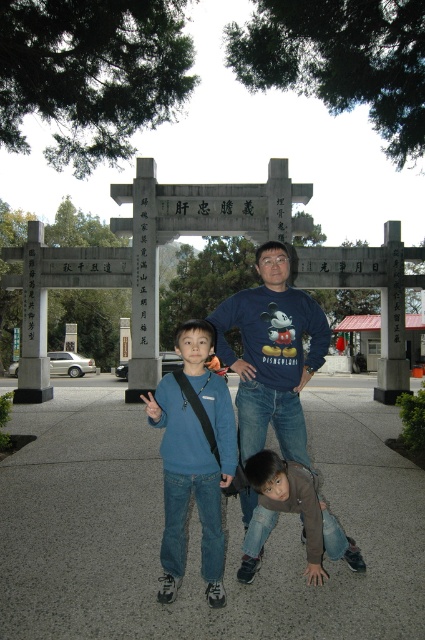
Question: Estimate the real-world distances between objects in this image. Which object is closer to the blue cotton shirt at center?

Choices:
 (A) matte blue sweater at center
 (B) brown denim jeans at lower center

Answer: (B)

Question: Which object appears farthest from the camera in this image?

Choices:
 (A) brown denim jeans at lower center
 (B) blue cotton shirt at center

Answer: (B)

Question: Which of these objects is positioned farthest from the matte blue sweater at center?

Choices:
 (A) brown denim jeans at lower center
 (B) blue cotton shirt at center

Answer: (B)

Question: Does matte blue sweater at center have a larger size compared to brown denim jeans at lower center?

Choices:
 (A) no
 (B) yes

Answer: (B)

Question: Can you confirm if matte blue sweater at center is bigger than brown denim jeans at lower center?

Choices:
 (A) yes
 (B) no

Answer: (A)

Question: Where is blue cotton shirt at center located in relation to matte blue sweater at center in the image?

Choices:
 (A) right
 (B) left

Answer: (A)